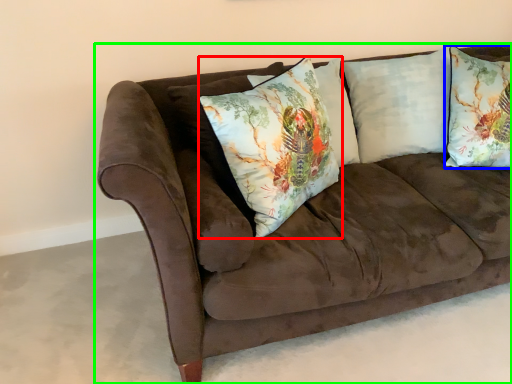
Question: Which object is positioned farthest from pillow (highlighted by a red box)? Select from pillow (highlighted by a blue box) and studio couch (highlighted by a green box).

Choices:
 (A) pillow
 (B) studio couch

Answer: (A)